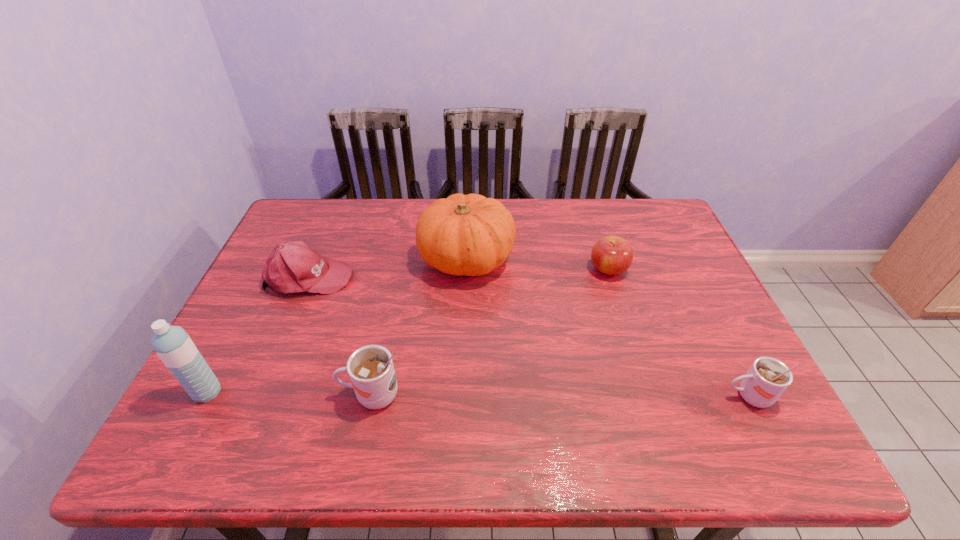
Identify the location of baseball cap located in the left edge section of the desktop. (293, 267).

Image resolution: width=960 pixels, height=540 pixels. I want to click on water bottle that is at the left edge, so click(172, 344).

Locate an element on the screen. The width and height of the screenshot is (960, 540). object that is positioned at the right edge is located at coordinates (767, 379).

Locate an element on the screen. The image size is (960, 540). object located in the near left corner section of the desktop is located at coordinates (172, 344).

Locate an element on the screen. The image size is (960, 540). object at the near right corner is located at coordinates (767, 379).

In the image, there is a desktop. Identify the location of vacant space at the far edge. This screenshot has width=960, height=540. (373, 232).

Where is `vacant space at the near edge of the desktop`? vacant space at the near edge of the desktop is located at coordinates tap(565, 388).

In order to click on blank space at the left edge of the desktop in this screenshot , I will do `click(246, 368)`.

I want to click on vacant space at the right edge of the desktop, so click(702, 328).

In the image, there is a desktop. Identify the location of free space at the far left corner. This screenshot has width=960, height=540. (321, 198).